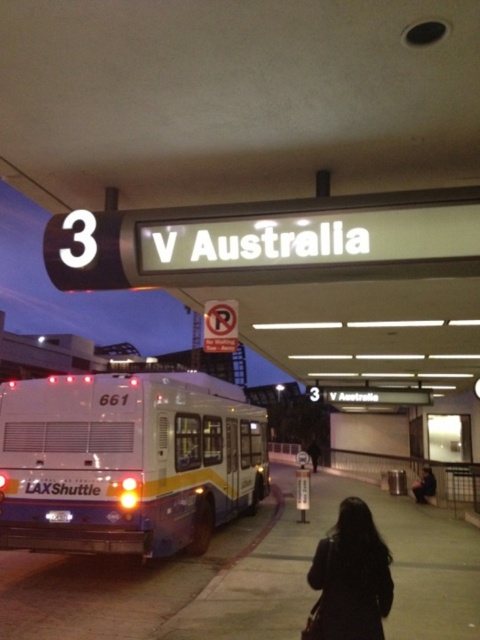
Question: Which of the following is the closest to the observer?

Choices:
 (A) black leather jacket at lower center
 (B) black fabric bag at lower center

Answer: (B)

Question: Can you confirm if white glossy bus at center is positioned to the right of black leather jacket at lower center?

Choices:
 (A) no
 (B) yes

Answer: (A)

Question: Is white glossy bus at center thinner than dark matte coat at center?

Choices:
 (A) no
 (B) yes

Answer: (B)

Question: Which point is closer to the camera?

Choices:
 (A) pos(86,444)
 (B) pos(427,492)
 (C) pos(312,451)
 (D) pos(380,609)

Answer: (D)

Question: Which object appears closest to the camera in this image?

Choices:
 (A) black leather jacket at lower center
 (B) white glossy bus at center

Answer: (B)

Question: Can you confirm if white glossy bus at center is thinner than black leather jacket at lower center?

Choices:
 (A) no
 (B) yes

Answer: (B)